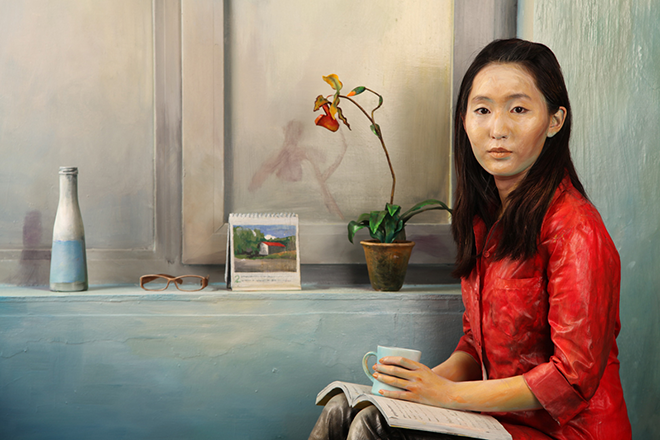
You are a GUI agent. You are given a task and a screenshot of the screen. Output one action in this format:
    pyautogui.click(x=<x>, y=<y>)
    Task: Click on the coffee mug handle
    
    Given the screenshot: What is the action you would take?
    pyautogui.click(x=364, y=363)